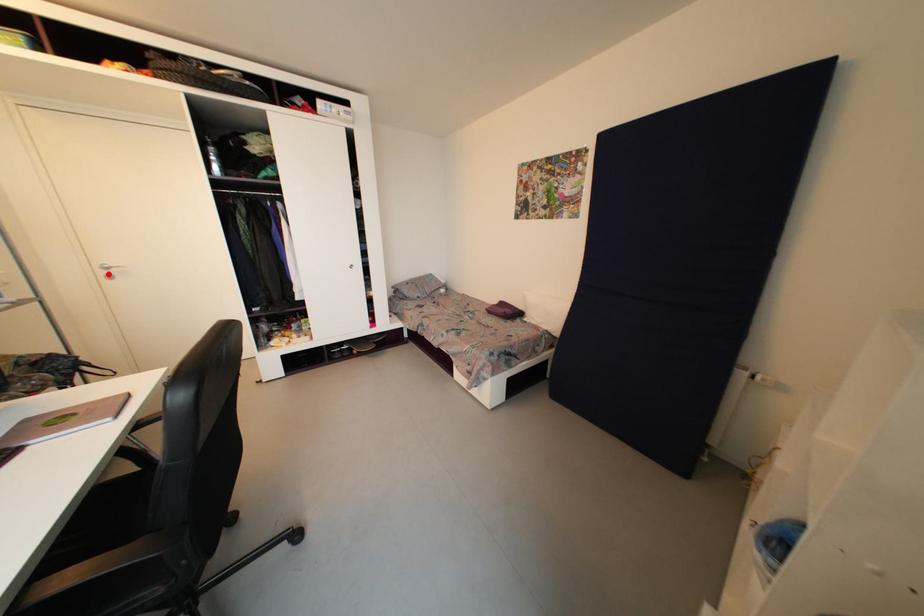
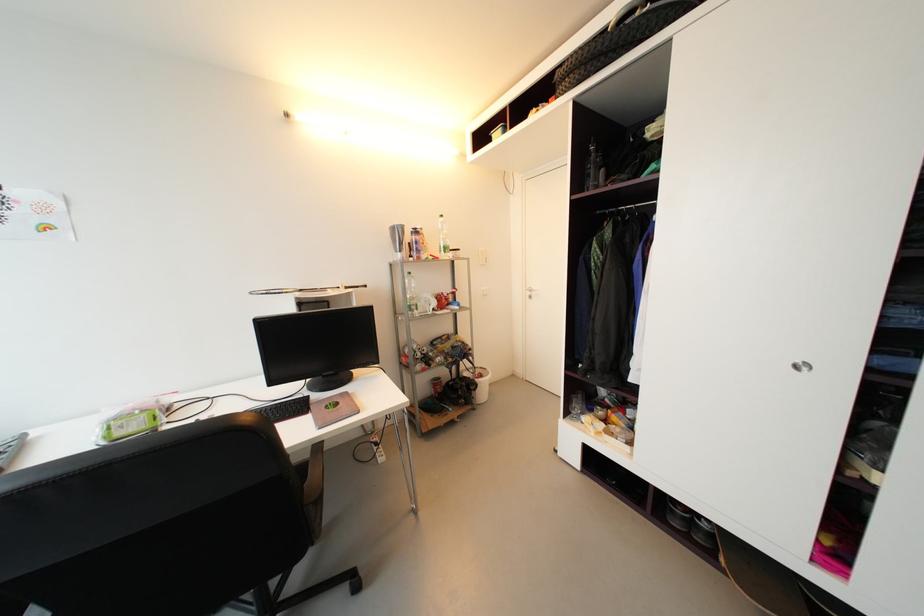
Where in the second image is the point corresponding to the highlighted location from the first image?

(533, 294)